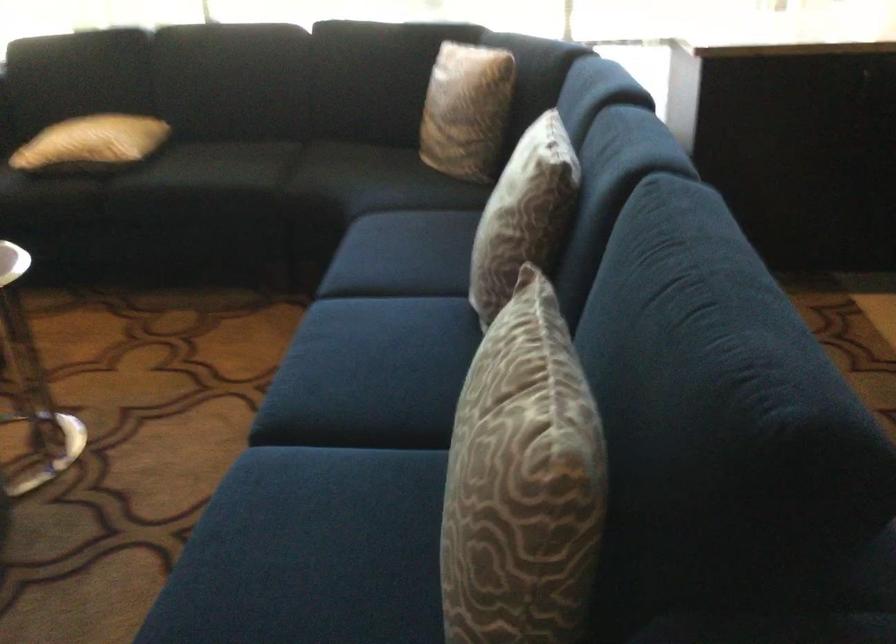
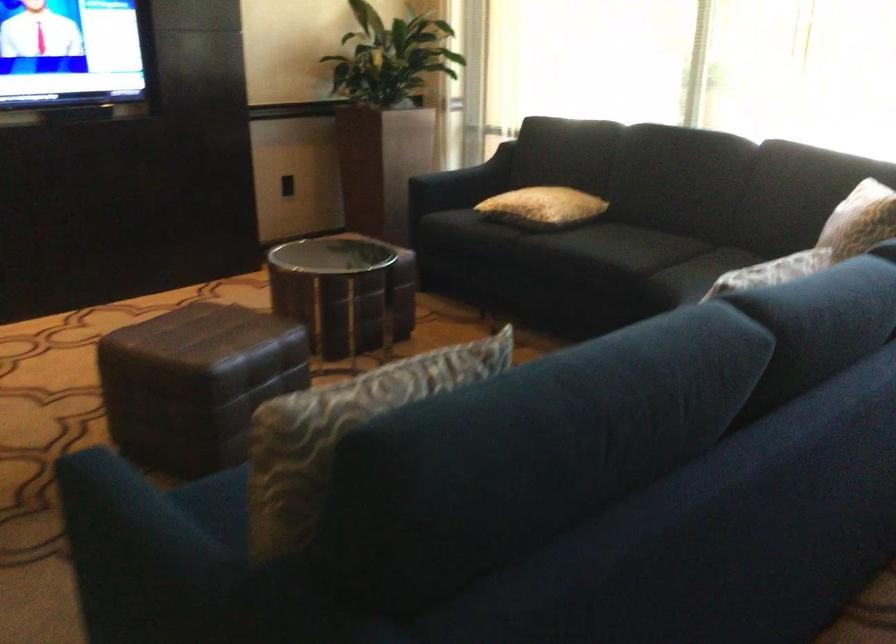
The point at (613, 435) is marked in the first image. Where is the corresponding point in the second image?

(340, 431)